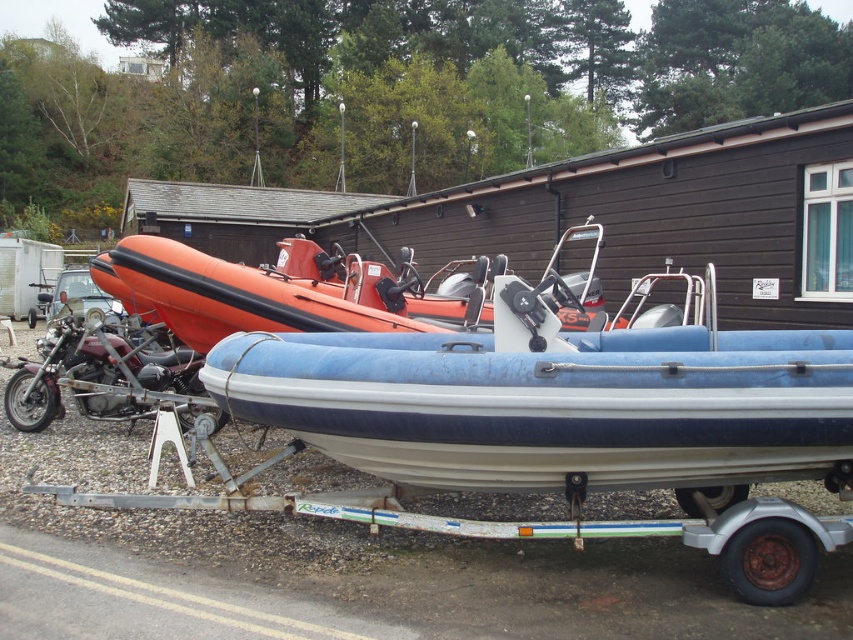
Question: Is blue rubber boat at center further to camera compared to shiny chrome motorcycle at left?

Choices:
 (A) yes
 (B) no

Answer: (B)

Question: Which object appears farthest from the camera in this image?

Choices:
 (A) shiny chrome motorcycle at left
 (B) blue rubber boat at center

Answer: (A)

Question: Is blue rubber boat at center bigger than shiny chrome motorcycle at left?

Choices:
 (A) yes
 (B) no

Answer: (A)

Question: Can you confirm if blue rubber boat at center is thinner than shiny chrome motorcycle at left?

Choices:
 (A) no
 (B) yes

Answer: (A)